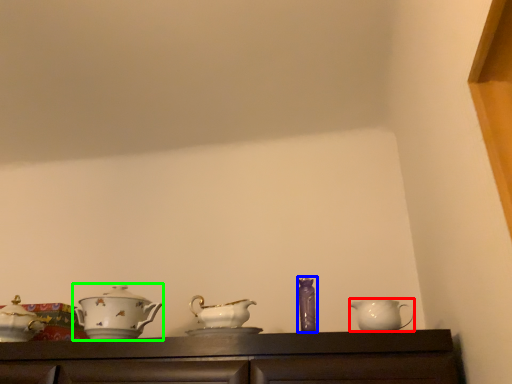
Question: Which object is the farthest from jug (highlighted by a red box)? Choose among these: tableware (highlighted by a blue box) or tableware (highlighted by a green box).

Choices:
 (A) tableware
 (B) tableware

Answer: (B)